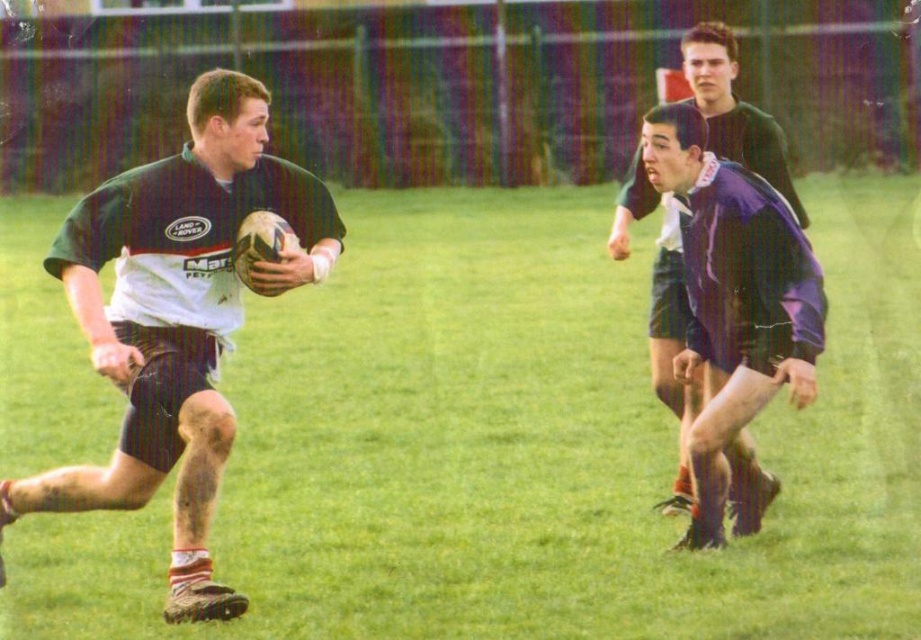
In the rugby match scene, you see a matte green rugby ball at left and purple fabric shorts at right. Which object appears bigger in the image?

The matte green rugby ball at left appears bigger than the purple fabric shorts at right in the image.

You are a photographer standing at the center of the field. You want to take a photo that includes both the point at coordinates point (125,216) and point (673,246). Which point should you focus on first to ensure both are in focus?

You should focus on point (125,216) first because it is closer to the camera than point (673,246), ensuring both points are within the depth of field.

You are a sports analyst reviewing the rugby match footage. You need to determine which object in the image is wider between the matte green rugby ball at left and the purple fabric shorts at right. Based on the spatial details, which one is wider?

The matte green rugby ball at left is wider than the purple fabric shorts at right according to the spatial details provided.